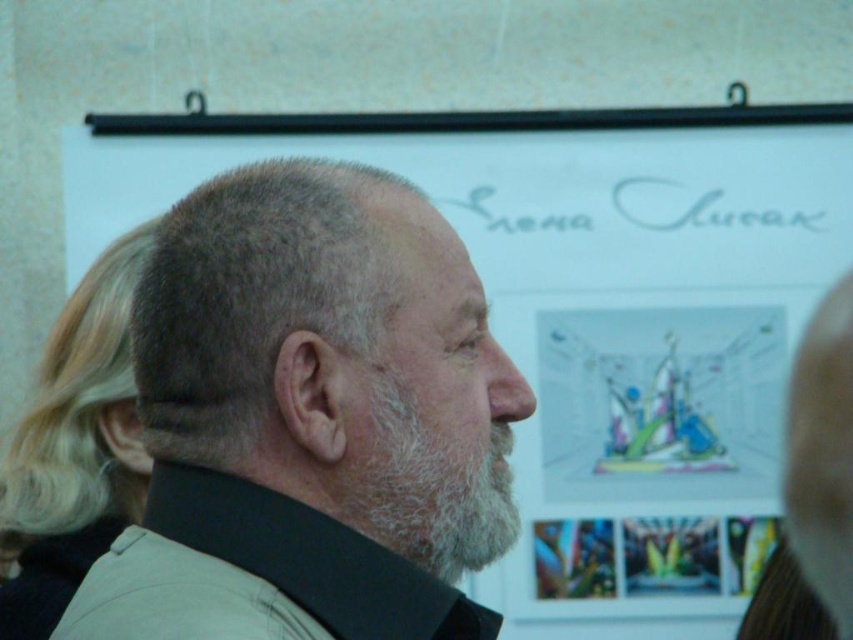
Question: Which point appears closest to the camera in this image?

Choices:
 (A) (444, 500)
 (B) (113, 308)
 (C) (350, 326)
 (D) (463, 500)

Answer: (C)

Question: Which object is the closest to the blonde hair at left?

Choices:
 (A) gray hair at center
 (B) gray matte hair at center

Answer: (B)

Question: Considering the real-world distances, which object is closest to the blonde hair at left?

Choices:
 (A) gray matte hair at center
 (B) white fuzzy beard at center

Answer: (A)

Question: Is gray hair at center further to camera compared to blonde hair at left?

Choices:
 (A) yes
 (B) no

Answer: (B)

Question: Can you confirm if gray hair at center is bigger than gray matte hair at center?

Choices:
 (A) yes
 (B) no

Answer: (A)

Question: Can you confirm if gray matte hair at center is smaller than white fuzzy beard at center?

Choices:
 (A) yes
 (B) no

Answer: (B)